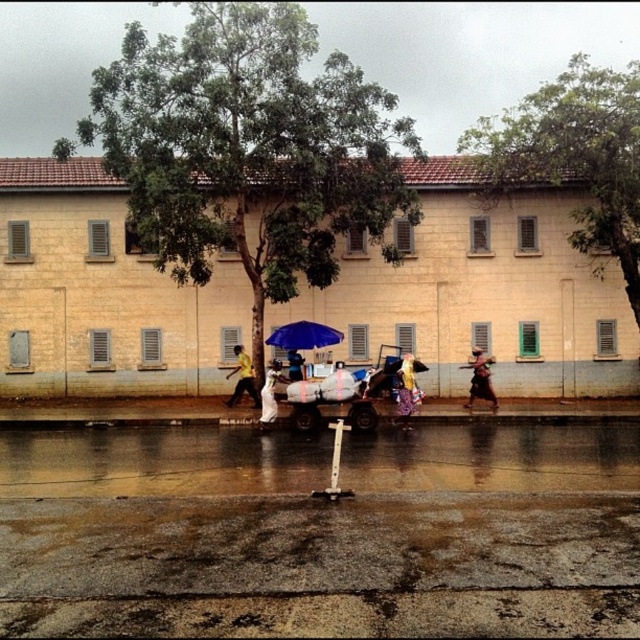
Question: Can you confirm if blue matte umbrella at center is positioned to the left of matte yellow shirt at center?

Choices:
 (A) yes
 (B) no

Answer: (B)

Question: Which object appears closest to the camera in this image?

Choices:
 (A) matte yellow shirt at center
 (B) yellow fabric dress at center

Answer: (B)

Question: Which object appears closest to the camera in this image?

Choices:
 (A) white matte dress at center
 (B) matte yellow shirt at center

Answer: (A)

Question: Estimate the real-world distances between objects in this image. Which object is farther from the matte black umbrella at center?

Choices:
 (A) matte yellow shirt at center
 (B) blue matte umbrella at center
 (C) white matte dress at center

Answer: (C)

Question: Is yellow fabric dress at center further to camera compared to matte black umbrella at center?

Choices:
 (A) no
 (B) yes

Answer: (A)

Question: Where is yellow fabric dress at center located in relation to yellow matte shirt at center in the image?

Choices:
 (A) above
 (B) below

Answer: (B)